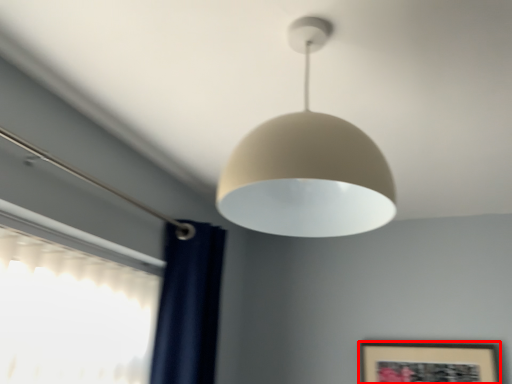
Question: From the image's perspective, what is the correct spatial positioning of picture frame (annotated by the red box) in reference to lamp?

Choices:
 (A) above
 (B) below

Answer: (B)